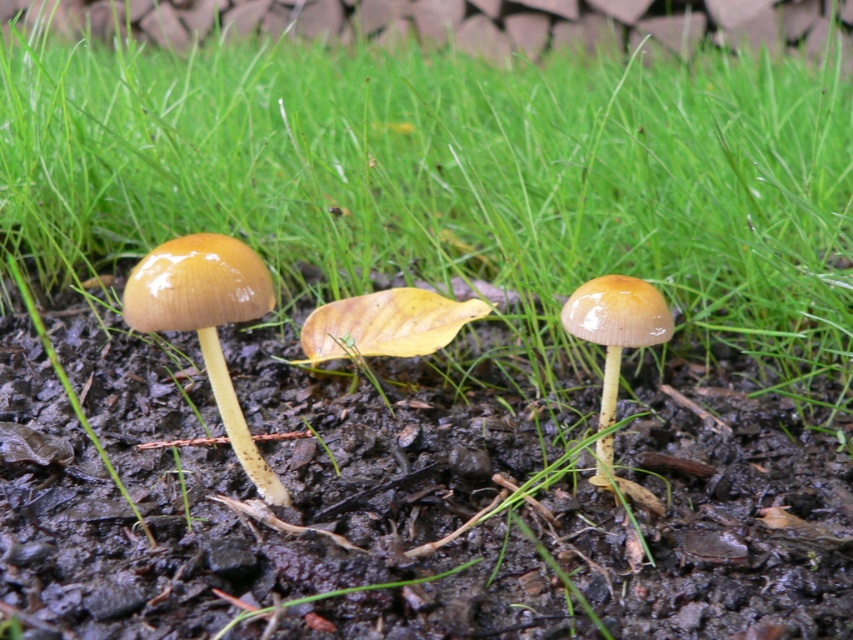
Who is higher up, glossy yellow mushroom at left or glossy yellow mushroom at center?

glossy yellow mushroom at center

Consider the image. Who is positioned more to the right, glossy yellow mushroom at left or glossy yellow mushroom at center?

glossy yellow mushroom at center

Who is more forward, (180, 259) or (573, 316)?

Point (180, 259)

The image size is (853, 640). I want to click on glossy yellow mushroom at left, so click(207, 321).